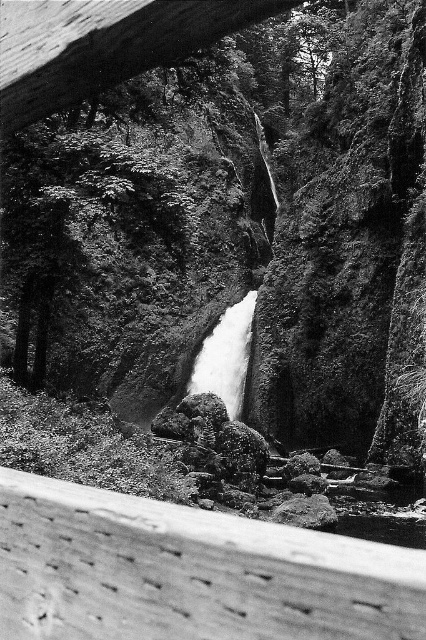
You are standing at the edge of the canyon looking at the waterfall. There are two points marked in the image. One is at coordinate point(172, 28) and the other at point(203, 385). Which point is closer to you?

Point(172, 28) is in front of point(203, 385), so it is closer to you.

You are a hiker trying to cross the river at the bottom of the waterfall. You see a smooth wooden beam at lower left and a white smooth waterfall at center. Which object is positioned to the left of the other?

The smooth wooden beam at lower left is positioned to the left of the white smooth waterfall at center.

You are an engineer assessing the stability of the wooden beams in the waterfall scene. Which beam is shorter in height between the smooth wooden beam at lower left and the wooden beam at upper center?

The smooth wooden beam at lower left has a lesser height compared to the wooden beam at upper center, so the smooth wooden beam at lower left is shorter in height.